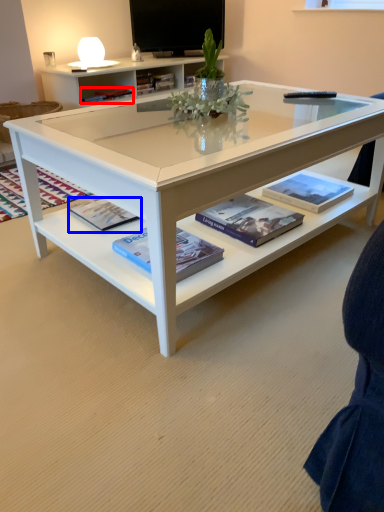
Question: Which object is closer to the camera taking this photo, book (highlighted by a red box) or paperback book (highlighted by a blue box)?

Choices:
 (A) book
 (B) paperback book

Answer: (B)